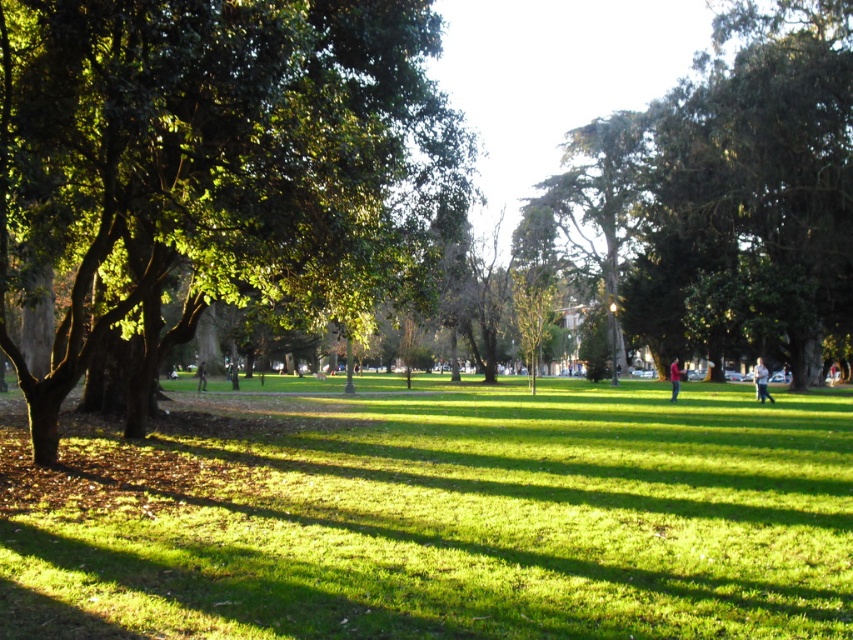
Question: Which point is farther to the camera?

Choices:
 (A) light brown leather jacket at center
 (B) light brown wooden bench at center
 (C) red matte jacket at center

Answer: (B)

Question: Is green grassy at center thinner than light brown wooden bench at center?

Choices:
 (A) no
 (B) yes

Answer: (A)

Question: Which point appears farthest from the camera in this image?

Choices:
 (A) (231, 385)
 (B) (711, 528)
 (C) (677, 392)
 (D) (204, 381)

Answer: (D)

Question: Estimate the real-world distances between objects in this image. Which object is closer to the green grassy at center?

Choices:
 (A) light brown wooden bench at center
 (B) red matte jacket at center
 (C) green leafy tree at center

Answer: (C)

Question: Does light brown leather jacket at center appear over light brown wooden bench at center?

Choices:
 (A) no
 (B) yes

Answer: (A)

Question: Observing the image, what is the correct spatial positioning of green grassy at center in reference to light blue jeans at lower right?

Choices:
 (A) left
 (B) right

Answer: (A)